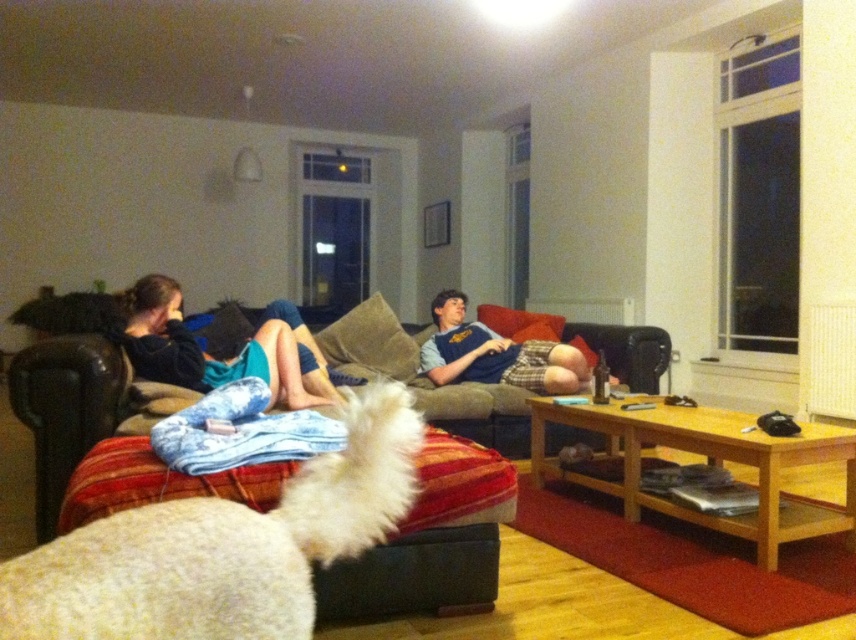
You are trying to decide whether to place a new rectangular pet bed in the living room. The pet bed is the same width as the blue jersey at center. Based on the scene, will the white fluffy dog at lower left fit comfortably on the pet bed?

The white fluffy dog at lower left is narrower than the blue jersey at center, so the pet bed with the same width as the blue jersey at center would be wide enough to accommodate the white fluffy dog at lower left comfortably.

You are a guest in the living room and want to place a small potted plant between the white fluffy dog at lower left and the blue denim shorts at left. Considering their heights, which object should the plant be placed above to ensure it is visible to both?

The plant should be placed above the white fluffy dog at lower left because it is shorter than the blue denim shorts at left, ensuring visibility over the dog.